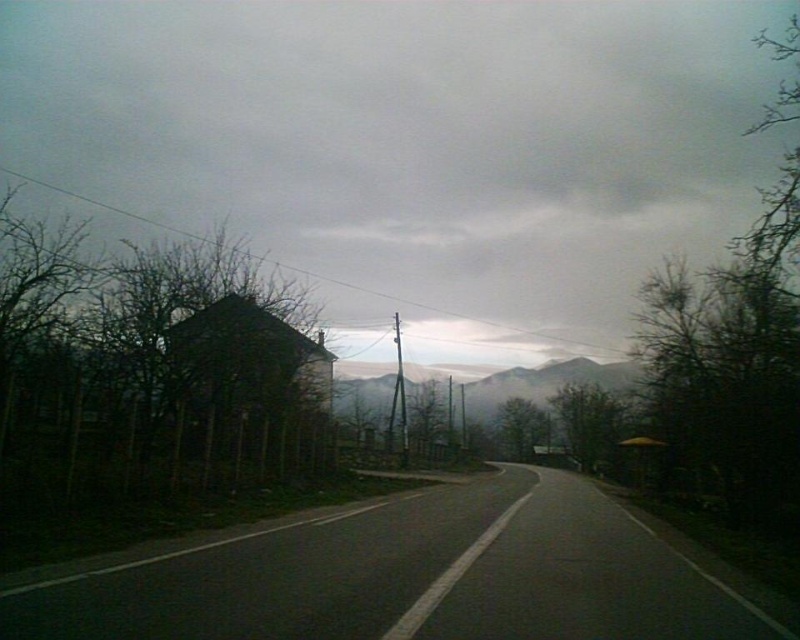
Question: Is black asphalt road at center below foggy misty mountains at center?

Choices:
 (A) yes
 (B) no

Answer: (B)

Question: In this image, where is black asphalt road at center located relative to foggy misty mountains at center?

Choices:
 (A) below
 (B) above

Answer: (B)

Question: Considering the real-world distances, which object is farthest from the black asphalt road at center?

Choices:
 (A) foggy misty mountains at center
 (B) dark brown wooden hut at center

Answer: (A)

Question: Which object appears farthest from the camera in this image?

Choices:
 (A) black asphalt road at center
 (B) dark brown wooden hut at center
 (C) foggy misty mountains at center

Answer: (C)

Question: Considering the relative positions of black asphalt road at center and foggy misty mountains at center in the image provided, where is black asphalt road at center located with respect to foggy misty mountains at center?

Choices:
 (A) left
 (B) right

Answer: (A)

Question: Which point is farther to the camera?

Choices:
 (A) dark brown wooden hut at center
 (B) black asphalt road at center
 (C) foggy misty mountains at center

Answer: (C)